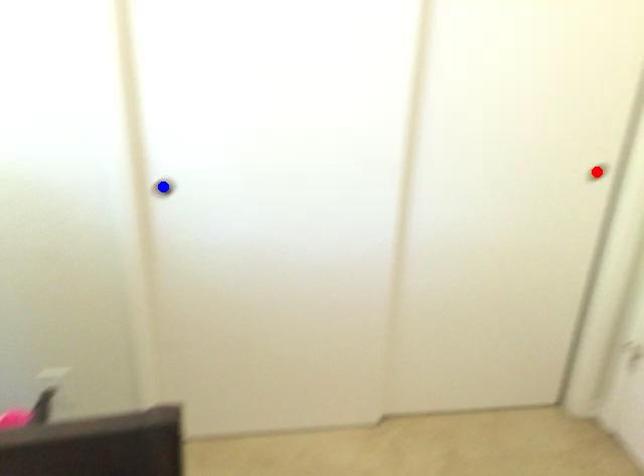
Question: Two points are marked on the image. Which point is closer to the camera?

Choices:
 (A) Blue point is closer.
 (B) Red point is closer.

Answer: (A)